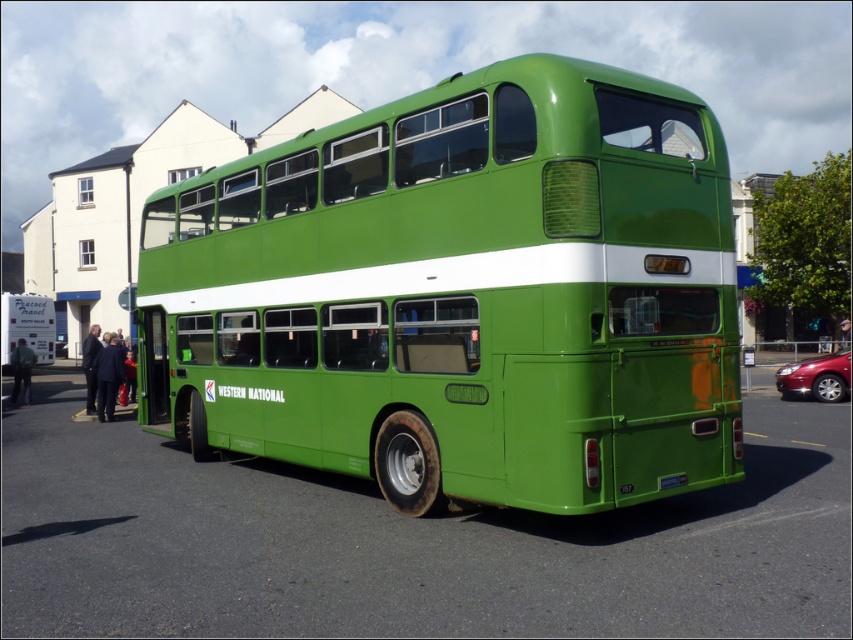
Is green matte/deck bus at center to the right of green matte bus at center from the viewer's perspective?

No, green matte/deck bus at center is not to the right of green matte bus at center.

This screenshot has width=853, height=640. What do you see at coordinates (461, 294) in the screenshot? I see `green matte/deck bus at center` at bounding box center [461, 294].

You are a GUI agent. You are given a task and a screenshot of the screen. Output one action in this format:
    pyautogui.click(x=<x>, y=<y>)
    Task: Click on the green matte/deck bus at center
    The width and height of the screenshot is (853, 640).
    Given the screenshot: What is the action you would take?
    pyautogui.click(x=461, y=294)

Who is positioned more to the left, green matte/deck bus at center or green plastic license plate at rear?

From the viewer's perspective, green matte/deck bus at center appears more on the left side.

Who is shorter, green matte/deck bus at center or green plastic license plate at rear?

green plastic license plate at rear

Between point (677, 259) and point (683, 474), which one is positioned in front?

Point (683, 474) is in front.

The image size is (853, 640). I want to click on green matte/deck bus at center, so click(461, 294).

Does green matte bus at center appear over green plastic license plate at rear?

No, green matte bus at center is not above green plastic license plate at rear.

Can you confirm if green matte bus at center is smaller than green plastic license plate at rear?

No.

Between point (666, 572) and point (659, 481), which one is positioned behind?

Positioned behind is point (659, 481).

Locate an element on the screen. green matte bus at center is located at coordinates (407, 545).